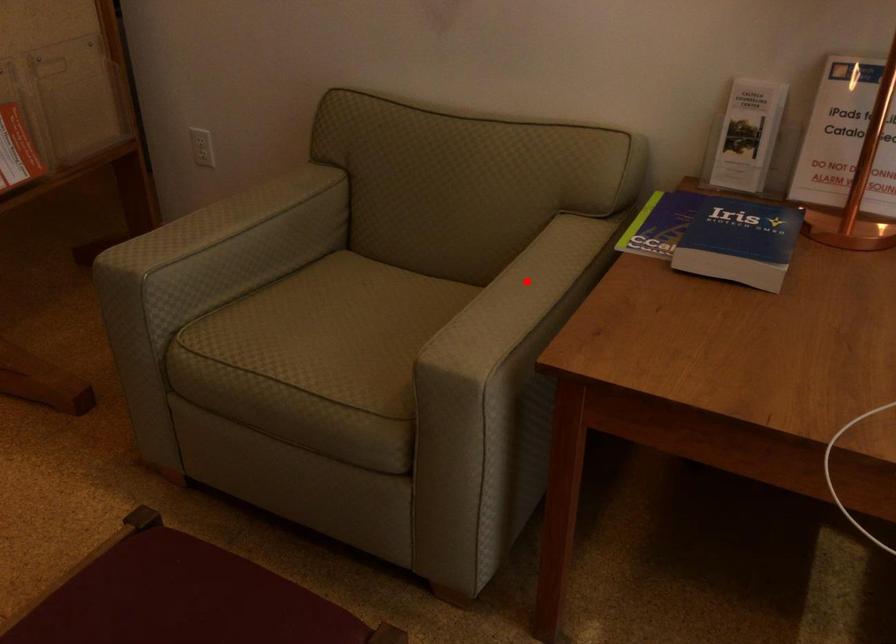
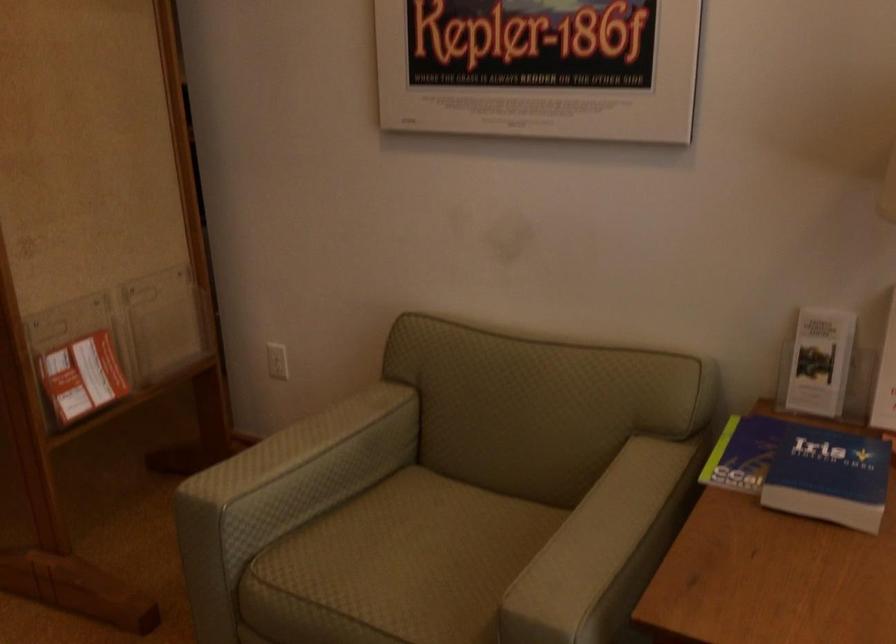
The point at the highlighted location is marked in the first image. Where is the corresponding point in the second image?

(607, 520)